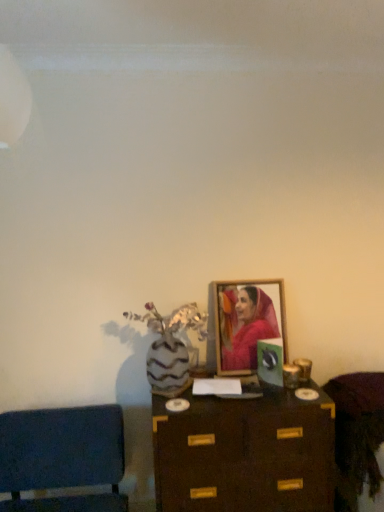
Question: From the image's perspective, is wooden cabinet at lower right, the 2th furniture viewed from the left, under velvet blue cushion at lower left, placed as the 1th furniture when sorted from left to right?

Choices:
 (A) yes
 (B) no

Answer: (B)

Question: Is velvet blue cushion at lower left, placed as the 1th furniture when sorted from left to right, inside wooden cabinet at lower right, acting as the 1th furniture starting from the right?

Choices:
 (A) yes
 (B) no

Answer: (B)

Question: Is wooden cabinet at lower right, acting as the 1th furniture starting from the right, bigger than velvet blue cushion at lower left, the 2th furniture in the right-to-left sequence?

Choices:
 (A) no
 (B) yes

Answer: (A)

Question: Is the depth of wooden cabinet at lower right, acting as the 1th furniture starting from the right, greater than that of velvet blue cushion at lower left, the 2th furniture in the right-to-left sequence?

Choices:
 (A) yes
 (B) no

Answer: (A)

Question: Does wooden cabinet at lower right, acting as the 1th furniture starting from the right, have a smaller size compared to velvet blue cushion at lower left, the 2th furniture in the right-to-left sequence?

Choices:
 (A) yes
 (B) no

Answer: (A)

Question: Is brown wooden table at center situated inside velvet blue cushion at lower left, the 2th furniture in the right-to-left sequence, or outside?

Choices:
 (A) outside
 (B) inside

Answer: (A)

Question: Considering the positions of brown wooden table at center and velvet blue cushion at lower left, placed as the 1th furniture when sorted from left to right, in the image, is brown wooden table at center taller or shorter than velvet blue cushion at lower left, placed as the 1th furniture when sorted from left to right,?

Choices:
 (A) tall
 (B) short

Answer: (A)

Question: Considering the positions of brown wooden table at center and velvet blue cushion at lower left, the 2th furniture in the right-to-left sequence, in the image, is brown wooden table at center wider or thinner than velvet blue cushion at lower left, the 2th furniture in the right-to-left sequence,?

Choices:
 (A) thin
 (B) wide

Answer: (A)

Question: From the image's perspective, relative to velvet blue cushion at lower left, the 2th furniture in the right-to-left sequence, is brown wooden table at center above or below?

Choices:
 (A) above
 (B) below

Answer: (A)

Question: Is wooden framed portrait at center in front of or behind velvet blue cushion at lower left, placed as the 1th furniture when sorted from left to right, in the image?

Choices:
 (A) front
 (B) behind

Answer: (B)

Question: From a real-world perspective, is wooden framed portrait at center above or below velvet blue cushion at lower left, placed as the 1th furniture when sorted from left to right?

Choices:
 (A) below
 (B) above

Answer: (B)

Question: Is wooden framed portrait at center taller or shorter than velvet blue cushion at lower left, the 2th furniture in the right-to-left sequence?

Choices:
 (A) tall
 (B) short

Answer: (B)

Question: Is wooden framed portrait at center inside or outside of velvet blue cushion at lower left, the 2th furniture in the right-to-left sequence?

Choices:
 (A) outside
 (B) inside

Answer: (A)

Question: Is point (49, 421) positioned closer to the camera than point (243, 295)?

Choices:
 (A) farther
 (B) closer

Answer: (B)

Question: From a real-world perspective, is velvet blue cushion at lower left, the 2th furniture in the right-to-left sequence, physically located above or below wooden framed portrait at center?

Choices:
 (A) above
 (B) below

Answer: (B)